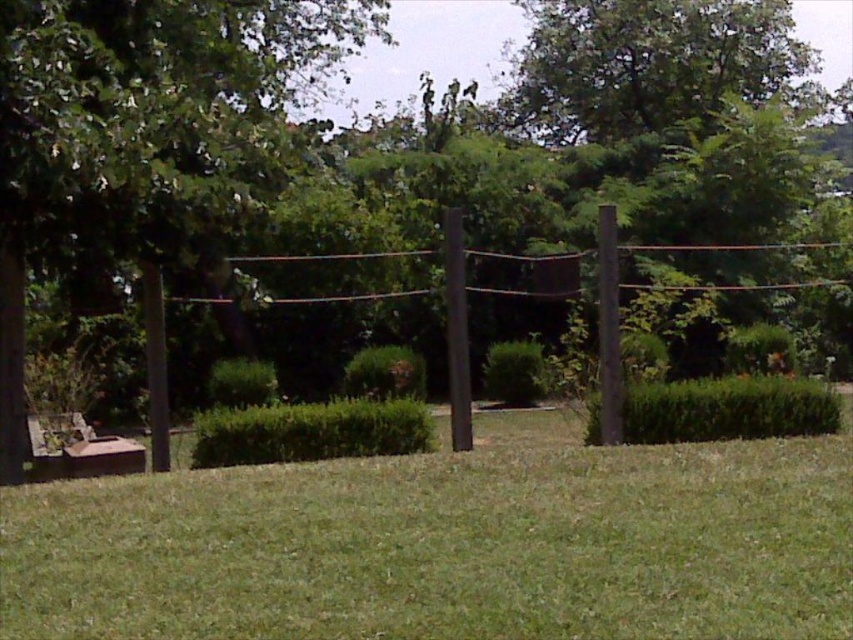
Question: Does green leafy tree at left have a smaller size compared to brown wooden telegraph pole at right?

Choices:
 (A) no
 (B) yes

Answer: (A)

Question: Is green grass at center closer to the viewer compared to green leafy tree at left?

Choices:
 (A) no
 (B) yes

Answer: (B)

Question: Which object appears closest to the camera in this image?

Choices:
 (A) green leafy tree at left
 (B) green grass at center
 (C) smooth brown post at left

Answer: (B)

Question: Which point is closer to the camera?

Choices:
 (A) black matte telegraph pole at center
 (B) green grass at center
 (C) brown wooden telegraph pole at right
 (D) green leafy tree at left

Answer: (B)

Question: Can you confirm if green grass at center is bigger than wooden park bench at lower left?

Choices:
 (A) yes
 (B) no

Answer: (A)

Question: Estimate the real-world distances between objects in this image. Which object is closer to the brown wooden telegraph pole at right?

Choices:
 (A) wooden park bench at lower left
 (B) green leafy tree at left

Answer: (A)